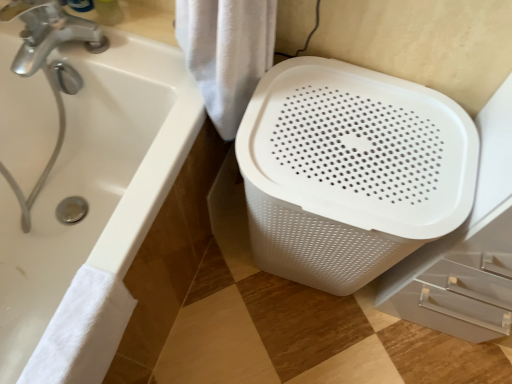
Question: Is white fabric towel at center, arranged as the 1th bath towel when viewed from the top, not close to white glossy bathtub at lower left?

Choices:
 (A) no
 (B) yes

Answer: (A)

Question: Can you confirm if white fabric towel at center, the 2th bath towel positioned from the left, is positioned to the right of white glossy bathtub at lower left?

Choices:
 (A) yes
 (B) no

Answer: (A)

Question: Considering the relative sizes of white fabric towel at center, which is the 1th bath towel in right-to-left order, and white glossy bathtub at lower left in the image provided, is white fabric towel at center, which is the 1th bath towel in right-to-left order, thinner than white glossy bathtub at lower left?

Choices:
 (A) no
 (B) yes

Answer: (B)

Question: Considering the relative sizes of white fabric towel at center, which is the 1th bath towel in right-to-left order, and white glossy bathtub at lower left in the image provided, is white fabric towel at center, which is the 1th bath towel in right-to-left order, wider than white glossy bathtub at lower left?

Choices:
 (A) no
 (B) yes

Answer: (A)

Question: Is white fabric towel at center, the second bath towel positioned from the bottom, positioned before white glossy bathtub at lower left?

Choices:
 (A) no
 (B) yes

Answer: (A)

Question: Is white fabric towel at center, which is the 1th bath towel in right-to-left order, spatially inside white glossy bathtub at lower left, or outside of it?

Choices:
 (A) outside
 (B) inside

Answer: (A)

Question: Considering the positions of point (246, 61) and point (118, 233), is point (246, 61) closer or farther from the camera than point (118, 233)?

Choices:
 (A) farther
 (B) closer

Answer: (A)

Question: In terms of height, does white fabric towel at center, arranged as the 1th bath towel when viewed from the top, look taller or shorter compared to white glossy bathtub at lower left?

Choices:
 (A) tall
 (B) short

Answer: (B)

Question: In the image, is white fabric towel at center, which is the 1th bath towel in right-to-left order, positioned in front of or behind white glossy bathtub at lower left?

Choices:
 (A) behind
 (B) front

Answer: (A)

Question: In the image, is white glossy bathtub at lower left positioned in front of or behind white fabric towel at center, arranged as the 1th bath towel when viewed from the top?

Choices:
 (A) front
 (B) behind

Answer: (A)

Question: From a real-world perspective, relative to white fabric towel at center, the second bath towel positioned from the bottom, is white glossy bathtub at lower left vertically above or below?

Choices:
 (A) above
 (B) below

Answer: (B)

Question: Would you say white glossy bathtub at lower left is inside or outside white fabric towel at center, the second bath towel positioned from the bottom?

Choices:
 (A) outside
 (B) inside

Answer: (A)

Question: Based on their positions, is white glossy bathtub at lower left located to the left or right of white fabric towel at center, the 2th bath towel positioned from the left?

Choices:
 (A) right
 (B) left

Answer: (B)

Question: Is white glossy bathtub at lower left inside or outside of white fluffy towel at lower left, placed as the 1th bath towel when sorted from left to right?

Choices:
 (A) outside
 (B) inside

Answer: (A)

Question: From a real-world perspective, is white glossy bathtub at lower left above or below white fluffy towel at lower left, positioned as the 2th bath towel in top-to-bottom order?

Choices:
 (A) below
 (B) above

Answer: (A)